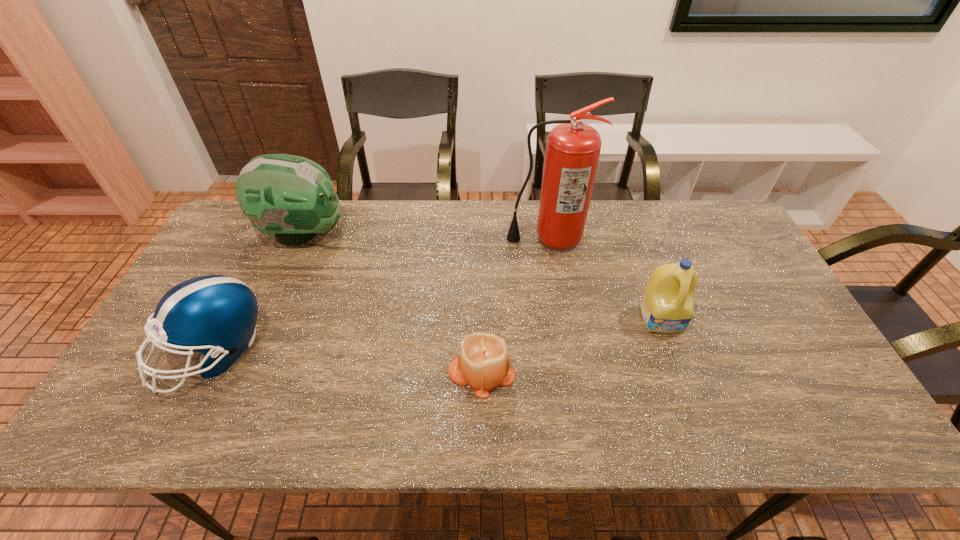
This screenshot has width=960, height=540. Identify the location of fire extinguisher that is at the far edge. (573, 148).

Image resolution: width=960 pixels, height=540 pixels. Find the location of `football helmet situated at the far edge`. football helmet situated at the far edge is located at coordinates [291, 198].

Where is `object present at the far left corner`? The height and width of the screenshot is (540, 960). object present at the far left corner is located at coordinates (291, 198).

In the image, there is a desktop. Where is `blank space at the far edge`? The height and width of the screenshot is (540, 960). blank space at the far edge is located at coordinates (641, 239).

At what (x,y) coordinates should I click in order to perform the action: click on free region at the near edge of the desktop. Please return your answer as a coordinate pair (x, y). This screenshot has height=540, width=960. Looking at the image, I should click on (369, 434).

This screenshot has width=960, height=540. Identify the location of vacant point at the left edge. (218, 249).

Find the location of a particular element. This screenshot has height=540, width=960. free space at the right edge is located at coordinates (772, 302).

In the image, there is a desktop. What are the coordinates of `free space at the far right corner` in the screenshot? It's located at (722, 245).

You are a GUI agent. You are given a task and a screenshot of the screen. Output one action in this format:
    pyautogui.click(x=<x>, y=<y>)
    Task: Click on the free space between the farther football helmet and the detergent
    The width and height of the screenshot is (960, 540).
    Given the screenshot: What is the action you would take?
    pyautogui.click(x=483, y=276)

What are the coordinates of `unoccupied position between the shorter football helmet and the rightmost object` in the screenshot? It's located at (438, 335).